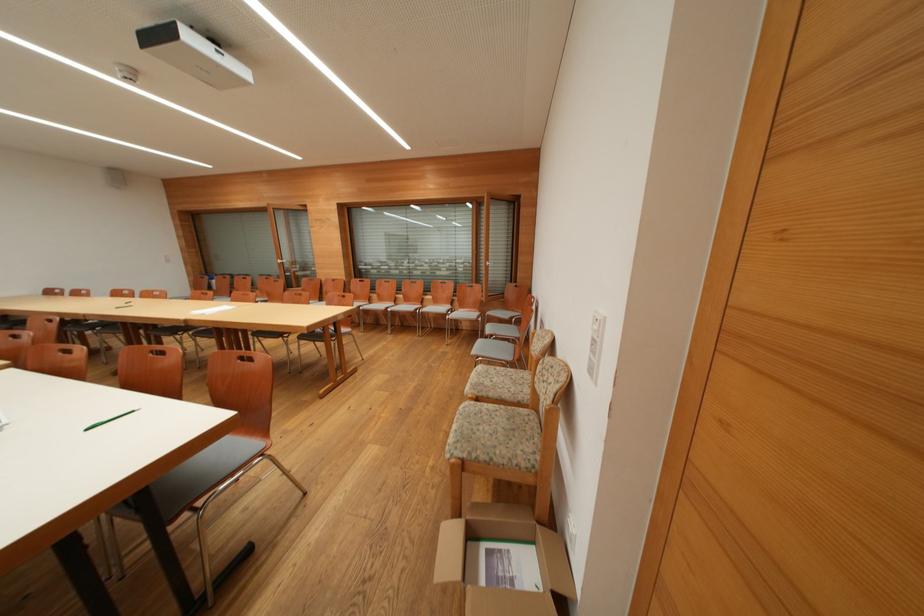
Find where to pull the window handle. Please return your answer as a coordinate pair (x, y).

(290, 272)